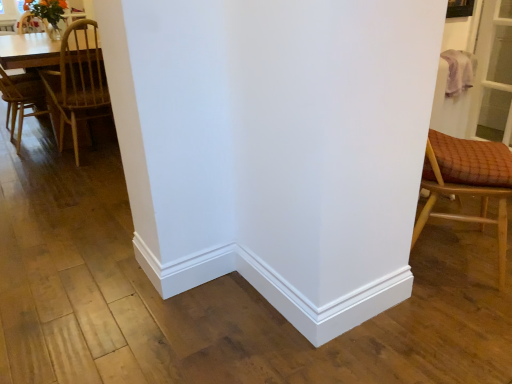
Question: Does wooden chair at left, marked as the first chair in a back-to-front arrangement, have a greater height compared to light brown wooden table at left?

Choices:
 (A) yes
 (B) no

Answer: (A)

Question: Are wooden chair at left, placed as the 2th chair when sorted from front to back, and light brown wooden table at left making contact?

Choices:
 (A) no
 (B) yes

Answer: (A)

Question: From the image's perspective, is wooden chair at left, marked as the first chair in a back-to-front arrangement, over light brown wooden table at left?

Choices:
 (A) yes
 (B) no

Answer: (B)

Question: Does wooden chair at left, placed as the 2th chair when sorted from right to left, have a greater width compared to light brown wooden table at left?

Choices:
 (A) yes
 (B) no

Answer: (A)

Question: Is wooden chair at left, marked as the first chair in a back-to-front arrangement, thinner than light brown wooden table at left?

Choices:
 (A) no
 (B) yes

Answer: (A)

Question: Is wooden chair at left, placed as the 2th chair when sorted from right to left, positioned beyond the bounds of light brown wooden table at left?

Choices:
 (A) yes
 (B) no

Answer: (A)

Question: Does light brown wooden table at left turn towards wooden checkered cushion at right, the 1th chair in the right-to-left sequence?

Choices:
 (A) yes
 (B) no

Answer: (B)

Question: Is light brown wooden table at left positioned with its back to wooden checkered cushion at right, arranged as the second chair when viewed from the back?

Choices:
 (A) yes
 (B) no

Answer: (B)

Question: Is light brown wooden table at left further to the viewer compared to wooden checkered cushion at right, marked as the second chair in a left-to-right arrangement?

Choices:
 (A) no
 (B) yes

Answer: (B)

Question: Considering the relative sizes of light brown wooden table at left and wooden checkered cushion at right, the 1th chair in the right-to-left sequence, in the image provided, is light brown wooden table at left smaller than wooden checkered cushion at right, the 1th chair in the right-to-left sequence,?

Choices:
 (A) yes
 (B) no

Answer: (B)

Question: From a real-world perspective, is light brown wooden table at left located higher than wooden checkered cushion at right, which is counted as the first chair, starting from the front?

Choices:
 (A) yes
 (B) no

Answer: (B)

Question: From the image's perspective, is light brown wooden table at left beneath wooden checkered cushion at right, marked as the second chair in a left-to-right arrangement?

Choices:
 (A) yes
 (B) no

Answer: (B)

Question: Would you say wooden checkered cushion at right, marked as the second chair in a left-to-right arrangement, is outside light brown wooden table at left?

Choices:
 (A) no
 (B) yes

Answer: (B)